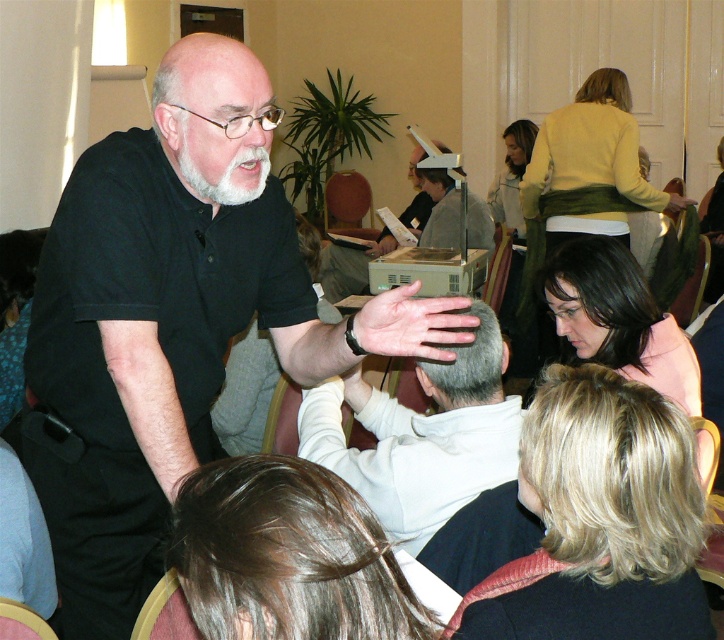
Question: Is black matte shirt at center to the right of green textured scarf at upper right from the viewer's perspective?

Choices:
 (A) yes
 (B) no

Answer: (B)

Question: Estimate the real-world distances between objects in this image. Which object is closer to the black matte shirt at center?

Choices:
 (A) white matte shirt at center
 (B) dark pink fabric at lower right
 (C) blonde hair at lower right
 (D) green textured scarf at upper right

Answer: (A)

Question: Considering the relative positions of black matte shirt at center and blonde hair at lower right in the image provided, where is black matte shirt at center located with respect to blonde hair at lower right?

Choices:
 (A) left
 (B) right

Answer: (A)

Question: Estimate the real-world distances between objects in this image. Which object is closer to the dark pink fabric at lower right?

Choices:
 (A) blonde hair at lower right
 (B) black matte shirt at center
 (C) white matte shirt at center
 (D) green textured scarf at upper right

Answer: (C)

Question: Which object is positioned closest to the blonde hair at lower right?

Choices:
 (A) white matte shirt at center
 (B) green textured scarf at upper right

Answer: (A)

Question: Is black matte shirt at center smaller than dark pink fabric at lower right?

Choices:
 (A) no
 (B) yes

Answer: (A)